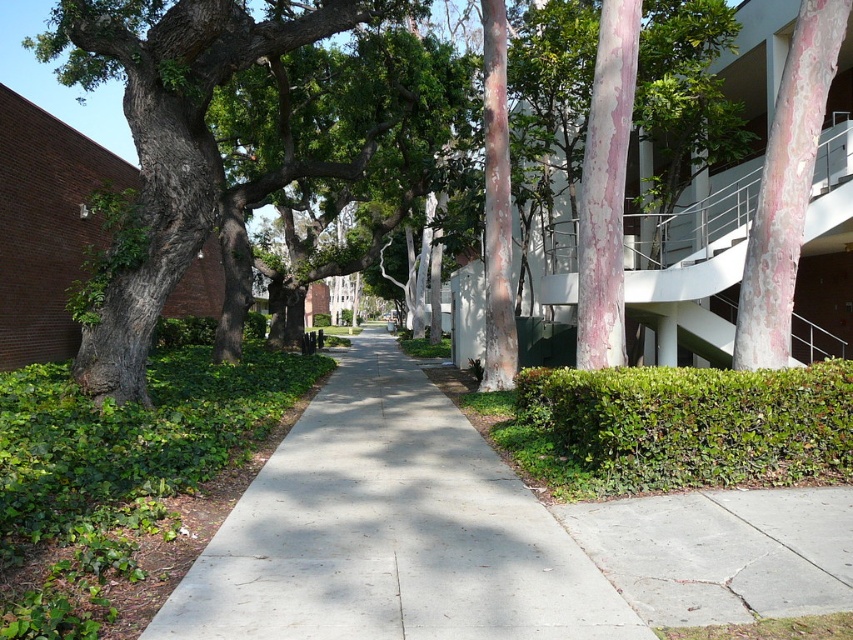
You are a gardener planning to plant a new tree in the garden. You want to choose between the green leafy tree at center and the pink textured bark at upper right. Which option would you recommend if you want a larger tree in your garden?

The green leafy tree at center is larger in size than the pink textured bark at upper right, so it would be the better choice for a larger tree in the garden.

You are standing at the point marked by coordinates point (178, 148) in the image. Which object is directly in front of you?

The point (178, 148) marks green leafy tree at center, so the green leafy tree at center is directly in front of you.